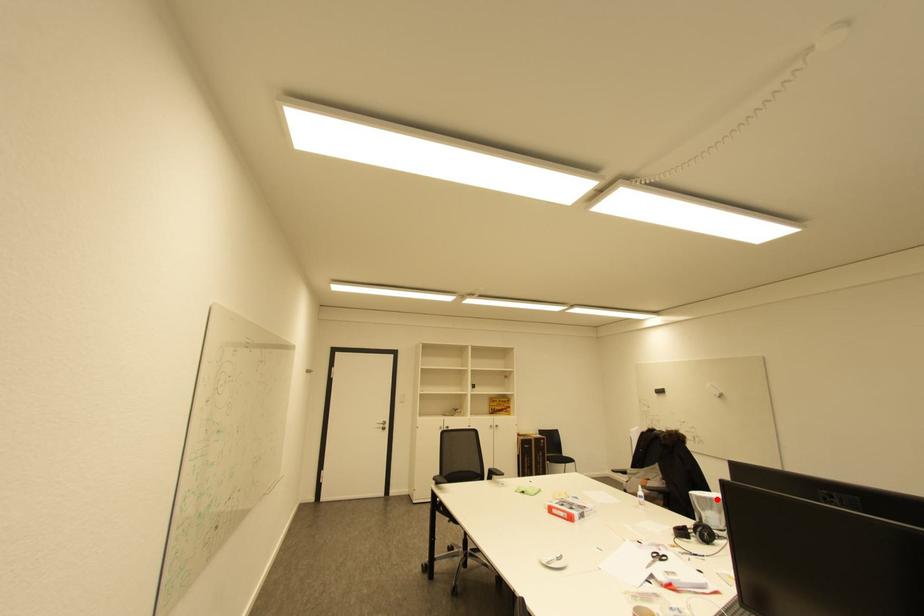
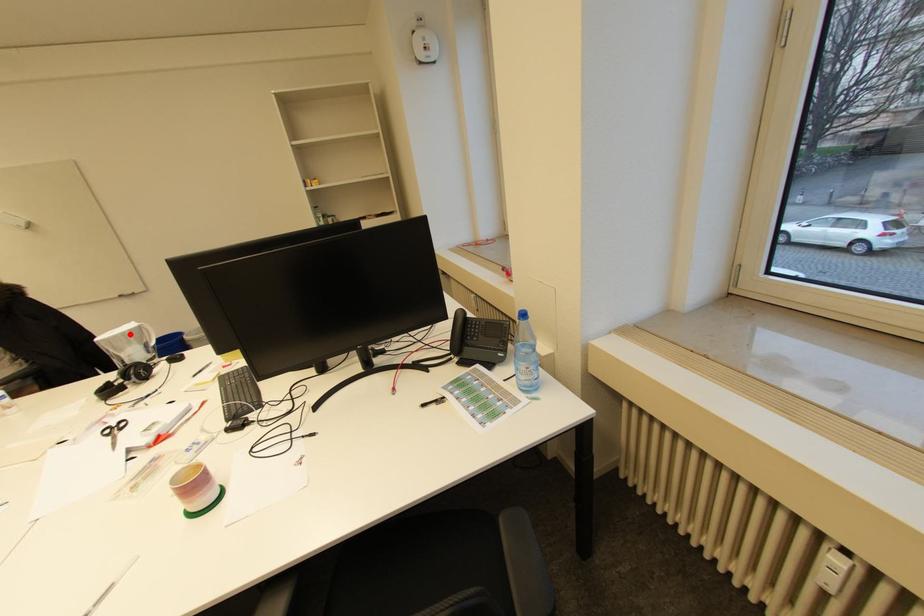
I am providing you with two images of the same scene from different viewpoints. A red point is marked on the first image and another point is marked on the second image. Is the red point in image1 aligned with the point shown in image2?

Yes